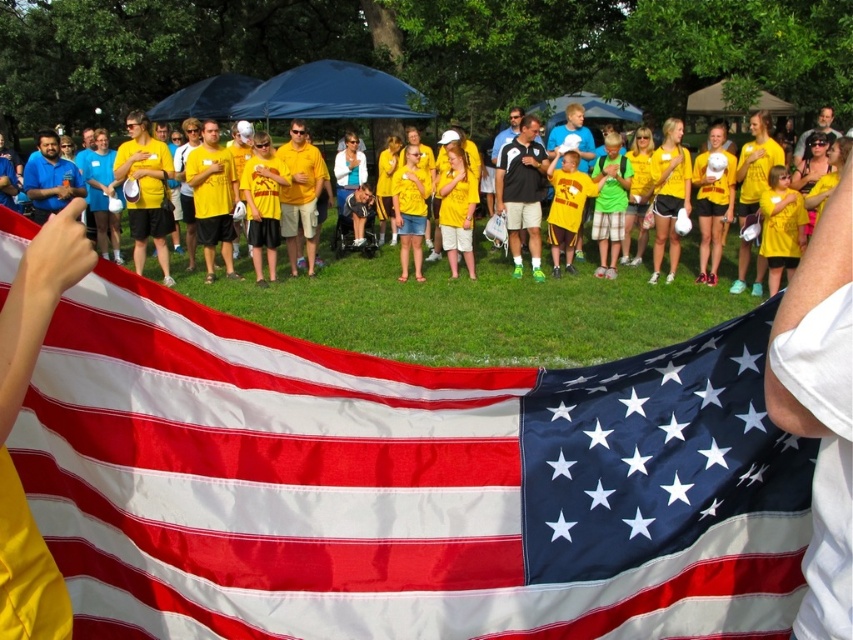
Question: Estimate the real-world distances between objects in this image. Which object is closer to the matte yellow shirt at upper right?

Choices:
 (A) matte fabric flag at center
 (B) yellow t-shirt at center

Answer: (B)

Question: Which point is farther to the camera?

Choices:
 (A) matte fabric flag at center
 (B) yellow t-shirt at center

Answer: (B)

Question: Is matte fabric flag at center smaller than matte yellow shirt at upper right?

Choices:
 (A) yes
 (B) no

Answer: (A)

Question: In this image, where is matte fabric flag at center located relative to matte yellow shirt at upper right?

Choices:
 (A) left
 (B) right

Answer: (A)

Question: Considering the real-world distances, which object is farthest from the yellow t-shirt at center?

Choices:
 (A) matte fabric flag at center
 (B) matte yellow shirt at upper right

Answer: (A)

Question: Does yellow t-shirt at center appear under matte yellow shirt at upper right?

Choices:
 (A) no
 (B) yes

Answer: (B)